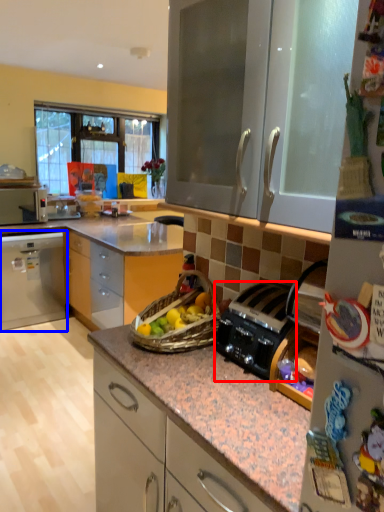
Question: Which object appears farthest to the camera in this image, kitchen appliance (highlighted by a red box) or cabinetry (highlighted by a blue box)?

Choices:
 (A) kitchen appliance
 (B) cabinetry

Answer: (B)